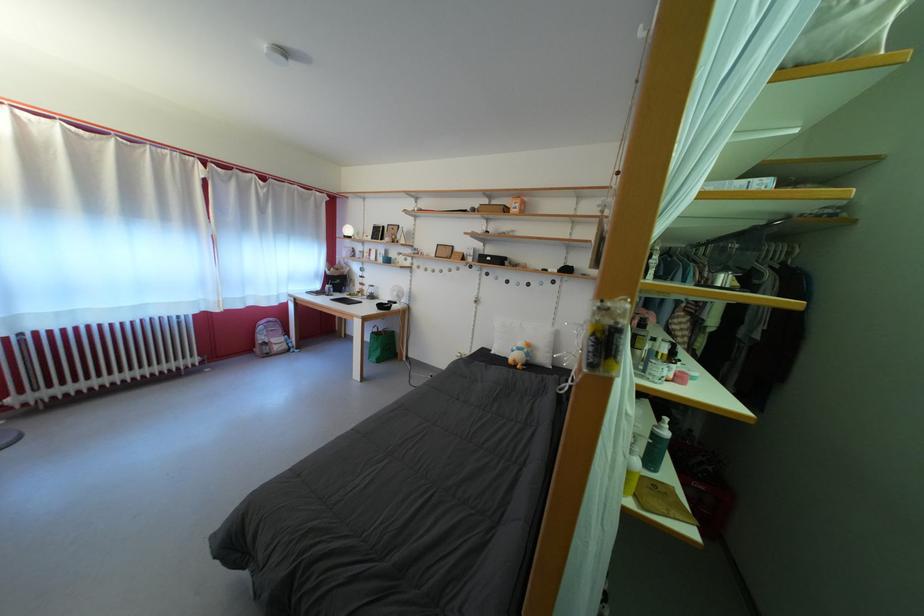
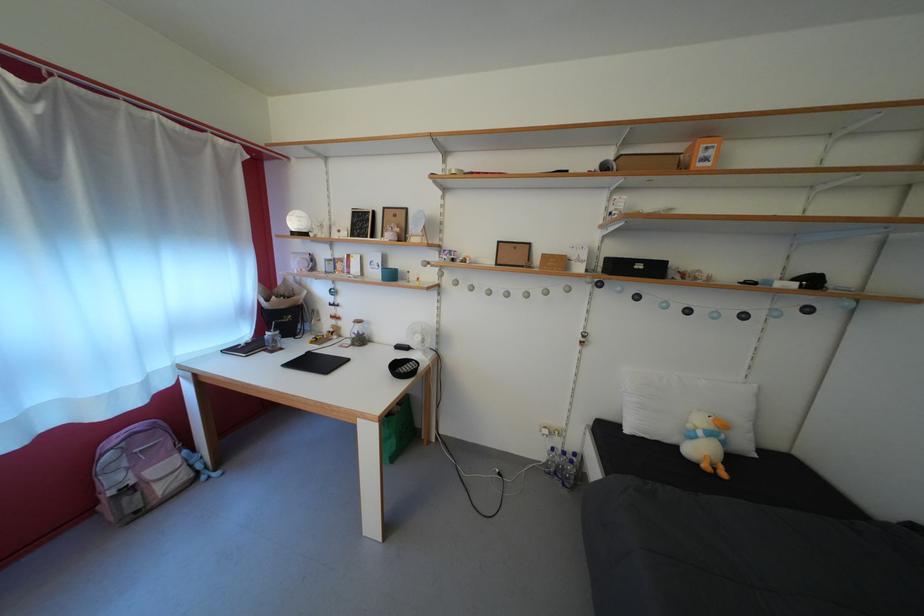
The point at (x=496, y=265) is marked in the first image. Where is the corresponding point in the second image?

(648, 273)